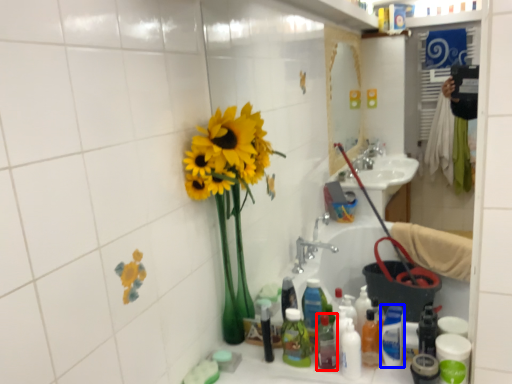
Question: Which of the following is the closest to the observer, bottle (highlighted by a red box) or cleaning product (highlighted by a blue box)?

Choices:
 (A) bottle
 (B) cleaning product

Answer: (B)